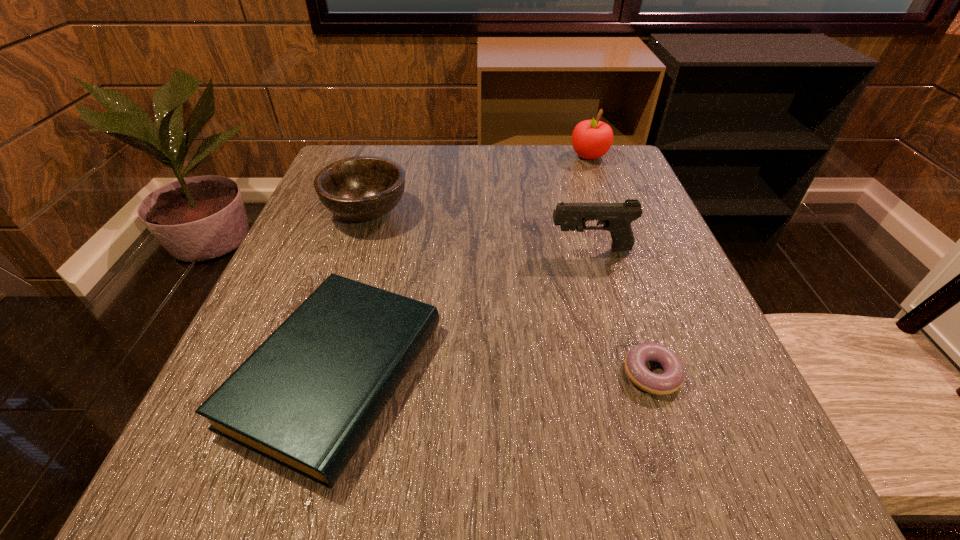
The width and height of the screenshot is (960, 540). Identify the location of vacant region that satisfies the following two spatial constraints: 1. on the front side of the doughnut; 2. on the right side of the book. (336, 374).

You are a GUI agent. You are given a task and a screenshot of the screen. Output one action in this format:
    pyautogui.click(x=<x>, y=<y>)
    Task: Click on the vacant space that satisfies the following two spatial constraints: 1. on the back side of the doughnut; 2. at the barrel of the third farthest object
    This screenshot has height=540, width=960.
    Given the screenshot: What is the action you would take?
    pyautogui.click(x=610, y=249)

Locate an element on the screen. This screenshot has height=540, width=960. free spot that satisfies the following two spatial constraints: 1. on the back side of the shortest object; 2. at the barrel of the pistol is located at coordinates (610, 249).

You are a GUI agent. You are given a task and a screenshot of the screen. Output one action in this format:
    pyautogui.click(x=<x>, y=<y>)
    Task: Click on the vacant position in the image that satisfies the following two spatial constraints: 1. on the front side of the second farthest object; 2. on the right side of the book
    This screenshot has width=960, height=540.
    Given the screenshot: What is the action you would take?
    (x=314, y=373)

The height and width of the screenshot is (540, 960). In order to click on free location that satisfies the following two spatial constraints: 1. on the back side of the book; 2. on the left side of the farthest object in this screenshot , I will do `click(397, 156)`.

This screenshot has width=960, height=540. I want to click on free location that satisfies the following two spatial constraints: 1. on the back side of the apple; 2. on the left side of the second farthest object, so click(385, 156).